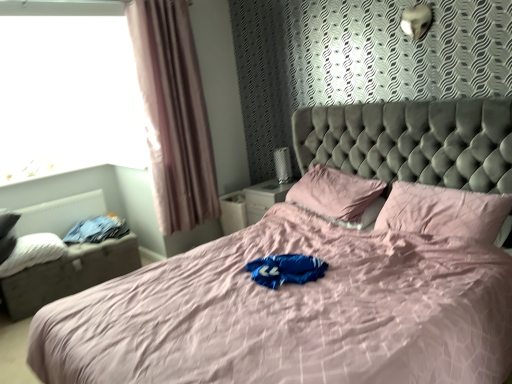
What do you see at coordinates (60, 214) in the screenshot?
I see `white textured radiator at left` at bounding box center [60, 214].

The image size is (512, 384). What do you see at coordinates (67, 91) in the screenshot?
I see `transparent glass window at upper left` at bounding box center [67, 91].

Locate an element on the screen. denim jeans at left is located at coordinates (97, 230).

Find the location of a particular element. The height and width of the screenshot is (384, 512). pink fabric pillow at upper right, positioned as the first pillow in right-to-left order is located at coordinates tap(444, 211).

The width and height of the screenshot is (512, 384). Find the location of `white soft pillow at left, the third pillow from the right`. white soft pillow at left, the third pillow from the right is located at coordinates (33, 252).

Where is `pink fabric curtain at left`? The height and width of the screenshot is (384, 512). pink fabric curtain at left is located at coordinates (173, 114).

Who is more distant, white textured radiator at left or pink fabric bed at center?

white textured radiator at left is further away from the camera.

Considering the sizes of objects white textured radiator at left and pink fabric bed at center in the image provided, who is wider, white textured radiator at left or pink fabric bed at center?

Wider between the two is pink fabric bed at center.

Is white textured radiator at left not within pink fabric bed at center?

Yes, white textured radiator at left is not within pink fabric bed at center.

From a real-world perspective, is white textured radiator at left physically located above or below pink fabric bed at center?

Clearly, from a real-world perspective, white textured radiator at left is below pink fabric bed at center.

How many degrees apart are the facing directions of white textured radiator at left and pink fabric curtain at left?

The facing directions of white textured radiator at left and pink fabric curtain at left are 0.554 degrees apart.

Which is in front, point (35, 227) or point (164, 234)?

Positioned in front is point (164, 234).

Would you consider white textured radiator at left to be distant from pink fabric curtain at left?

That's right, there is a large distance between white textured radiator at left and pink fabric curtain at left.

Does white textured radiator at left appear on the left side of pink fabric curtain at left?

Yes.

Does denim fabric footrest at lower left have a greater width compared to white soft pillow at left, the third pillow from the right?

Yes.

How distant is denim fabric footrest at lower left from white soft pillow at left, the third pillow from the right?

denim fabric footrest at lower left is 7.92 inches from white soft pillow at left, the third pillow from the right.

Considering the sizes of objects denim fabric footrest at lower left and white soft pillow at left, the first pillow from the left, in the image provided, who is smaller, denim fabric footrest at lower left or white soft pillow at left, the first pillow from the left,?

white soft pillow at left, the first pillow from the left, is smaller.

Find the location of a particular element. The width and height of the screenshot is (512, 384). pillow on the left of denim fabric footrest at lower left is located at coordinates click(33, 252).

Is pink fabric pillow at center, which is the 2th pillow from right to left, surrounding transparent glass window at upper left?

No.

From a real-world perspective, is pink fabric pillow at center, which is counted as the second pillow, starting from the left, positioned above or below transparent glass window at upper left?

From a real-world perspective, pink fabric pillow at center, which is counted as the second pillow, starting from the left, is physically below transparent glass window at upper left.

Based on the photo, between pink fabric pillow at center, which is the 2th pillow from right to left, and transparent glass window at upper left, which one is positioned behind?

transparent glass window at upper left is more distant.

Is pink fabric pillow at center, which is the 2th pillow from right to left, oriented towards transparent glass window at upper left?

No, pink fabric pillow at center, which is the 2th pillow from right to left, is not oriented towards transparent glass window at upper left.

Which object is positioned more to the right, pink fabric pillow at center, which is counted as the second pillow, starting from the left, or denim jeans at left?

Positioned to the right is pink fabric pillow at center, which is counted as the second pillow, starting from the left.

Is pink fabric pillow at center, which is the 2th pillow from right to left, beside denim jeans at left?

No.

From the image's perspective, which is below, pink fabric pillow at center, which is the 2th pillow from right to left, or denim jeans at left?

denim jeans at left.

Does pink fabric pillow at center, which is the 2th pillow from right to left, have a greater width compared to denim jeans at left?

No, pink fabric pillow at center, which is the 2th pillow from right to left, is not wider than denim jeans at left.

Which object is positioned more to the left, denim fabric footrest at lower left or transparent glass window at upper left?

transparent glass window at upper left is more to the left.

Is denim fabric footrest at lower left in contact with transparent glass window at upper left?

They are not placed beside each other.

In the scene shown: Would you say denim fabric footrest at lower left is outside transparent glass window at upper left?

Yes, denim fabric footrest at lower left is outside of transparent glass window at upper left.

Which is in front, denim fabric footrest at lower left or transparent glass window at upper left?

denim fabric footrest at lower left is more forward.

In terms of width, does pink fabric pillow at upper right, positioned as the first pillow in right-to-left order, look wider or thinner when compared to pink fabric bed at center?

Considering their sizes, pink fabric pillow at upper right, positioned as the first pillow in right-to-left order, looks slimmer than pink fabric bed at center.

Considering the sizes of objects pink fabric pillow at upper right, positioned as the first pillow in right-to-left order, and pink fabric bed at center in the image provided, who is shorter, pink fabric pillow at upper right, positioned as the first pillow in right-to-left order, or pink fabric bed at center?

pink fabric pillow at upper right, positioned as the first pillow in right-to-left order.

From a real-world perspective, between pink fabric pillow at upper right, acting as the third pillow starting from the left, and pink fabric bed at center, who is vertically lower?

In real-world perspective, pink fabric pillow at upper right, acting as the third pillow starting from the left, is lower.

I want to click on bed located below the white textured radiator at left (from the image's perspective), so click(x=290, y=314).

At what (x,y) coordinates should I click in order to perform the action: click on curtain above the white textured radiator at left (from a real-world perspective). Please return your answer as a coordinate pair (x, y). Looking at the image, I should click on (173, 114).

Which object lies further to the anchor point pink fabric curtain at left, pink fabric pillow at center, which is the 2th pillow from right to left, or white textured radiator at left?

pink fabric pillow at center, which is the 2th pillow from right to left, is further to pink fabric curtain at left.

From the image, which object appears to be nearer to transparent glass window at upper left, denim fabric footrest at lower left or pink fabric pillow at upper right, positioned as the first pillow in right-to-left order?

denim fabric footrest at lower left lies closer to transparent glass window at upper left than the other object.

Based on their spatial positions, is denim fabric footrest at lower left or white soft pillow at left, the first pillow from the left, closer to denim jeans at left?

The object closer to denim jeans at left is denim fabric footrest at lower left.

Considering their positions, is white soft pillow at left, the first pillow from the left, positioned closer to pink fabric pillow at center, which is the 2th pillow from right to left, than transparent glass window at upper left?

transparent glass window at upper left is closer to pink fabric pillow at center, which is the 2th pillow from right to left.

Looking at this image, based on their spatial positions, is pink fabric bed at center or white soft pillow at left, the first pillow from the left, closer to transparent glass window at upper left?

white soft pillow at left, the first pillow from the left, is positioned closer to the anchor transparent glass window at upper left.

Looking at the image, which one is located closer to white textured radiator at left, transparent glass window at upper left or denim jeans at left?

denim jeans at left is positioned closer to the anchor white textured radiator at left.

Looking at the image, which one is located closer to pink fabric curtain at left, white soft pillow at left, the first pillow from the left, or denim jeans at left?

denim jeans at left lies closer to pink fabric curtain at left than the other object.

Which object lies further to the anchor point denim fabric footrest at lower left, transparent glass window at upper left or white textured radiator at left?

Among the two, transparent glass window at upper left is located further to denim fabric footrest at lower left.

The width and height of the screenshot is (512, 384). What are the coordinates of `bed located between white soft pillow at left, the third pillow from the right, and pink fabric pillow at upper right, acting as the third pillow starting from the left, in the left-right direction` in the screenshot? It's located at (290, 314).

The height and width of the screenshot is (384, 512). Find the location of `pillow between pink fabric bed at center and pink fabric pillow at center, which is counted as the second pillow, starting from the left, in the front-back direction`. pillow between pink fabric bed at center and pink fabric pillow at center, which is counted as the second pillow, starting from the left, in the front-back direction is located at coordinates (444, 211).

The image size is (512, 384). I want to click on clothing between white textured radiator at left and pink fabric pillow at upper right, positioned as the first pillow in right-to-left order, so click(x=97, y=230).

Where is `clothing between denim fabric footrest at lower left and pink fabric pillow at center, which is counted as the second pillow, starting from the left`? clothing between denim fabric footrest at lower left and pink fabric pillow at center, which is counted as the second pillow, starting from the left is located at coordinates (97, 230).